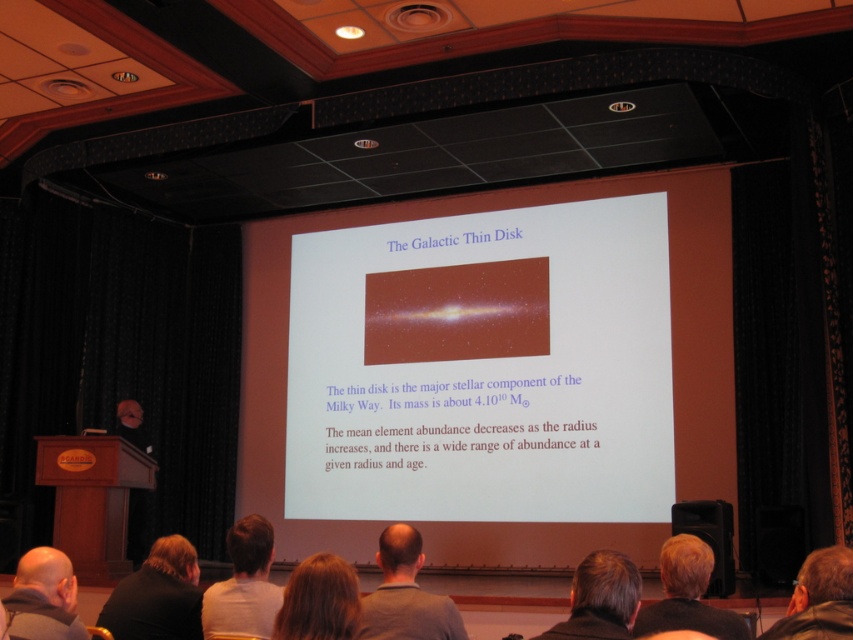
Question: Based on their relative distances, which object is nearer to the gray fabric shirt at center?

Choices:
 (A) black matte speaker at lower right
 (B) dark brown hair at lower center

Answer: (B)

Question: Is white matte shirt at lower left to the right of bald head at lower left from the viewer's perspective?

Choices:
 (A) yes
 (B) no

Answer: (A)

Question: Observing the image, what is the correct spatial positioning of bald head at lower left in reference to leather jacket at lower right?

Choices:
 (A) left
 (B) right

Answer: (A)

Question: Can you confirm if blonde hair at lower right is thinner than black matte speaker at lower right?

Choices:
 (A) yes
 (B) no

Answer: (A)

Question: Among these points, which one is nearest to the camera?

Choices:
 (A) (416, 637)
 (B) (698, 576)

Answer: (A)

Question: Among these objects, which one is farthest from the camera?

Choices:
 (A) matte orange slide at center
 (B) matte black mask at left
 (C) dark brown hair at lower left

Answer: (A)